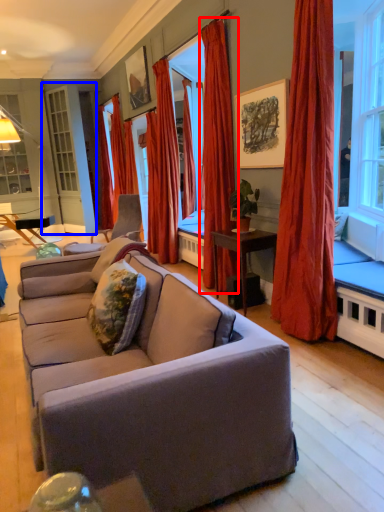
Question: Which object is closer to the camera taking this photo, curtain (highlighted by a red box) or screen door (highlighted by a blue box)?

Choices:
 (A) curtain
 (B) screen door

Answer: (A)